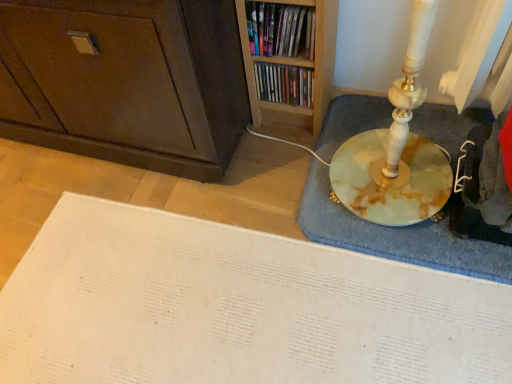
Question: Is wooden bookshelf at upper center, arranged as the second book when viewed from the back, at the left side of matte plastic books at upper center, acting as the 1th book starting from the back?

Choices:
 (A) no
 (B) yes

Answer: (B)

Question: From the image's perspective, would you say wooden bookshelf at upper center, the first book when ordered from front to back, is shown under matte plastic books at upper center, which appears as the second book when viewed from the front?

Choices:
 (A) yes
 (B) no

Answer: (B)

Question: From a real-world perspective, is wooden bookshelf at upper center, arranged as the second book when viewed from the back, physically below matte plastic books at upper center, acting as the 1th book starting from the back?

Choices:
 (A) yes
 (B) no

Answer: (B)

Question: Is there a large distance between wooden bookshelf at upper center, arranged as the second book when viewed from the back, and matte plastic books at upper center, which appears as the second book when viewed from the front?

Choices:
 (A) no
 (B) yes

Answer: (A)

Question: Considering the relative sizes of wooden bookshelf at upper center, the first book when ordered from front to back, and matte plastic books at upper center, which appears as the second book when viewed from the front, in the image provided, is wooden bookshelf at upper center, the first book when ordered from front to back, wider than matte plastic books at upper center, which appears as the second book when viewed from the front,?

Choices:
 (A) no
 (B) yes

Answer: (A)

Question: Does point (390, 107) appear closer or farther from the camera than point (274, 87)?

Choices:
 (A) closer
 (B) farther

Answer: (B)

Question: In the image, is marble bath mat at right on the left side or the right side of matte plastic books at upper center, acting as the 1th book starting from the back?

Choices:
 (A) left
 (B) right

Answer: (B)

Question: From the image's perspective, is marble bath mat at right located above or below matte plastic books at upper center, which appears as the second book when viewed from the front?

Choices:
 (A) above
 (B) below

Answer: (B)

Question: Considering the positions of marble bath mat at right and matte plastic books at upper center, which appears as the second book when viewed from the front, in the image, is marble bath mat at right bigger or smaller than matte plastic books at upper center, which appears as the second book when viewed from the front,?

Choices:
 (A) big
 (B) small

Answer: (A)

Question: Considering the positions of matte plastic books at upper center, acting as the 1th book starting from the back, and dark brown wood cabinet at lower left in the image, is matte plastic books at upper center, acting as the 1th book starting from the back, wider or thinner than dark brown wood cabinet at lower left?

Choices:
 (A) wide
 (B) thin

Answer: (B)

Question: Is matte plastic books at upper center, which appears as the second book when viewed from the front, bigger or smaller than dark brown wood cabinet at lower left?

Choices:
 (A) big
 (B) small

Answer: (B)

Question: Considering the positions of matte plastic books at upper center, acting as the 1th book starting from the back, and dark brown wood cabinet at lower left in the image, is matte plastic books at upper center, acting as the 1th book starting from the back, taller or shorter than dark brown wood cabinet at lower left?

Choices:
 (A) short
 (B) tall

Answer: (A)

Question: From the image's perspective, relative to dark brown wood cabinet at lower left, is matte plastic books at upper center, acting as the 1th book starting from the back, above or below?

Choices:
 (A) above
 (B) below

Answer: (B)

Question: Considering the positions of dark brown wood cabinet at lower left and marble bath mat at right in the image, is dark brown wood cabinet at lower left wider or thinner than marble bath mat at right?

Choices:
 (A) thin
 (B) wide

Answer: (A)

Question: From a real-world perspective, is dark brown wood cabinet at lower left positioned above or below marble bath mat at right?

Choices:
 (A) above
 (B) below

Answer: (A)